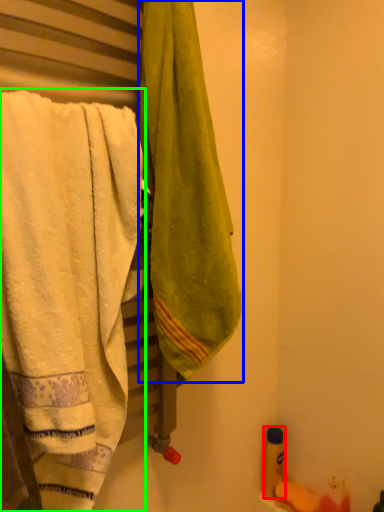
Question: Which is nearer to the toiletry (highlighted by a red box)? towel (highlighted by a blue box) or towel (highlighted by a green box).

Choices:
 (A) towel
 (B) towel

Answer: (A)